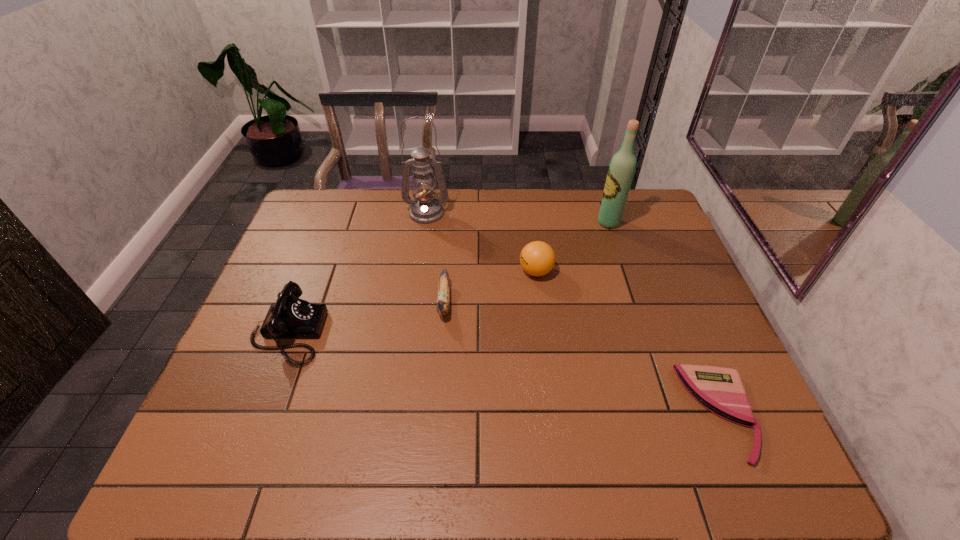
The height and width of the screenshot is (540, 960). I want to click on wine bottle situated at the right edge, so click(621, 170).

The image size is (960, 540). I want to click on wristlet present at the right edge, so click(x=720, y=390).

Identify the location of object at the far right corner. This screenshot has width=960, height=540. (621, 170).

The height and width of the screenshot is (540, 960). Identify the location of object that is at the near right corner. (720, 390).

Identify the location of vacant area at the far edge of the desktop. The image size is (960, 540). (511, 219).

In order to click on blank space at the near edge in this screenshot , I will do `click(550, 458)`.

The height and width of the screenshot is (540, 960). In the image, there is a desktop. Find the location of `vacant space at the left edge`. vacant space at the left edge is located at coordinates (324, 271).

This screenshot has height=540, width=960. I want to click on free spot at the right edge of the desktop, so click(x=676, y=272).

Where is `free space at the far right corner of the desktop`? free space at the far right corner of the desktop is located at coordinates (633, 214).

Locate an element on the screen. vacant space at the near right corner of the desktop is located at coordinates (780, 469).